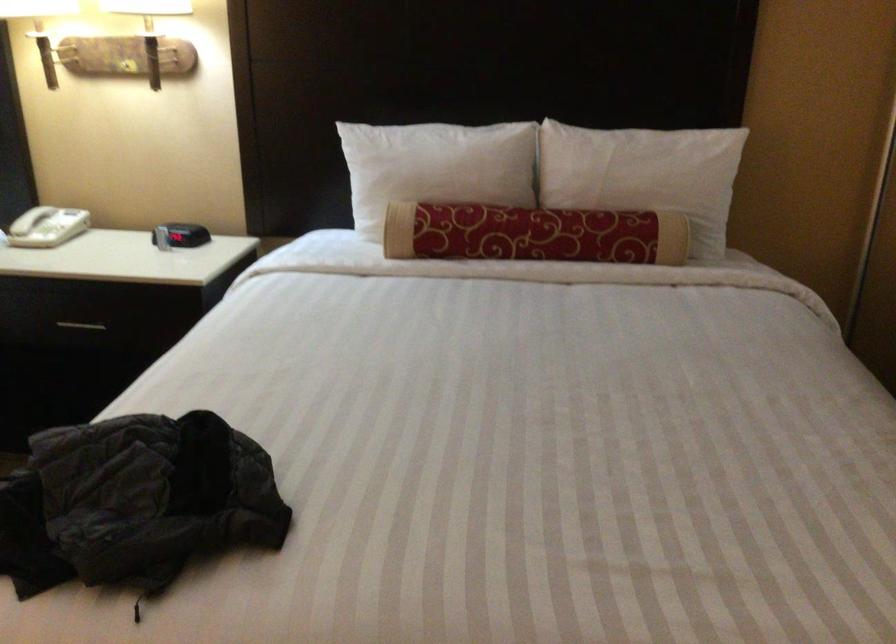
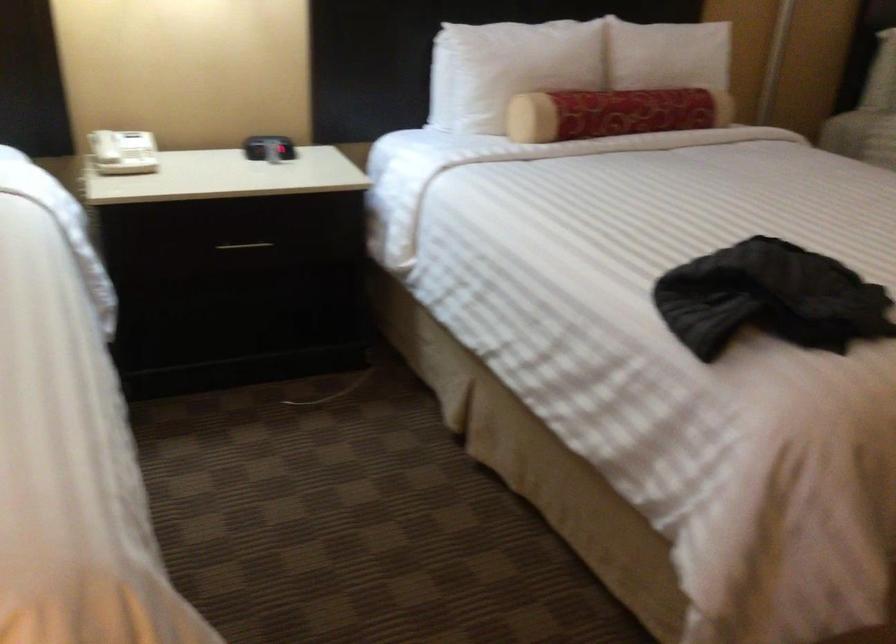
Question: In a continuous first-person perspective shot, in which direction is the camera moving?

Choices:
 (A) Left
 (B) Right
 (C) Forward
 (D) Backward

Answer: (A)